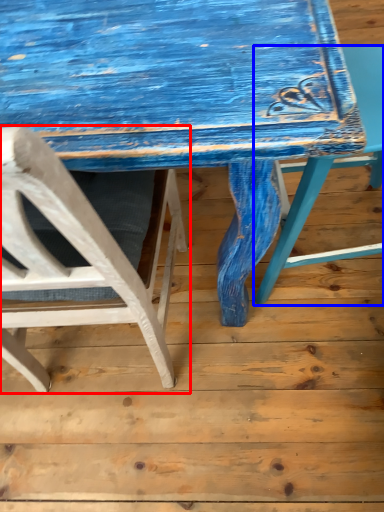
Question: Which object appears farthest to the camera in this image, chair (highlighted by a red box) or chair (highlighted by a blue box)?

Choices:
 (A) chair
 (B) chair

Answer: (B)